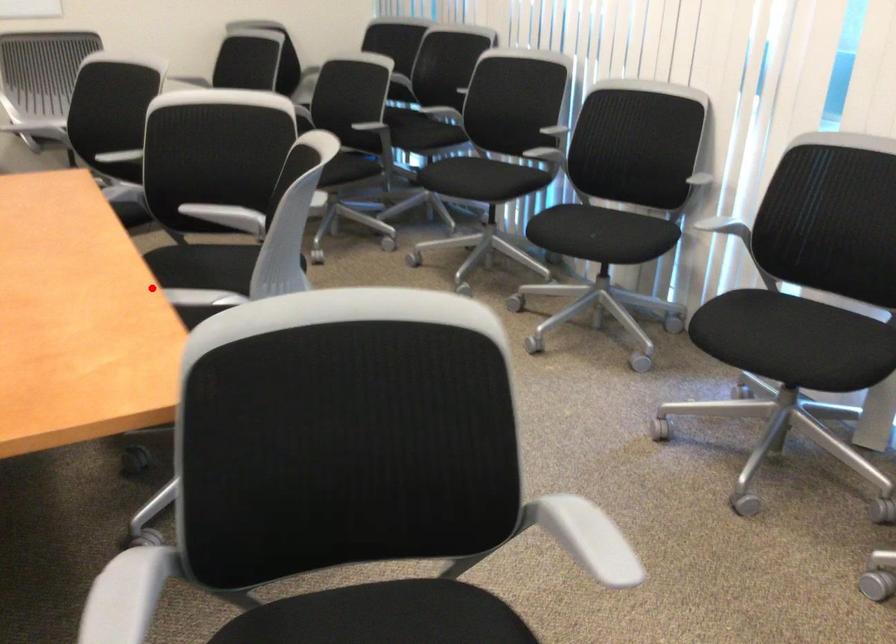
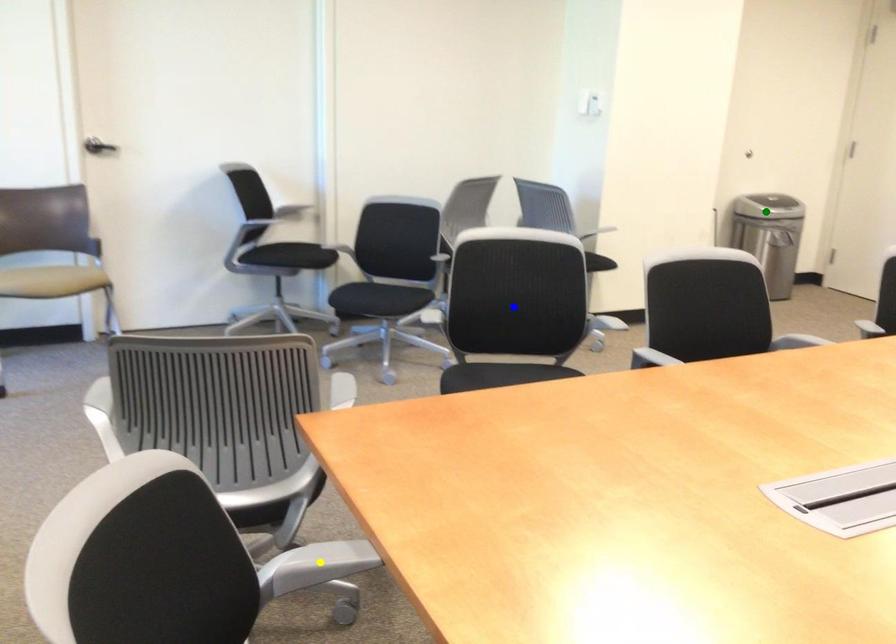
Question: I am providing you with two images of the same scene from different viewpoints. A red point is marked on the first image. You are given multiple points on the second image. In image 2, which mark is for the same physical point as the one in image 1?

Choices:
 (A) blue point
 (B) yellow point
 (C) green point

Answer: (B)